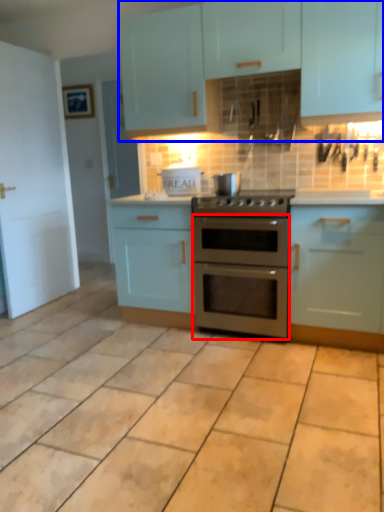
Question: Which object appears closest to the camera in this image, oven (highlighted by a red box) or cabinetry (highlighted by a blue box)?

Choices:
 (A) oven
 (B) cabinetry

Answer: (B)